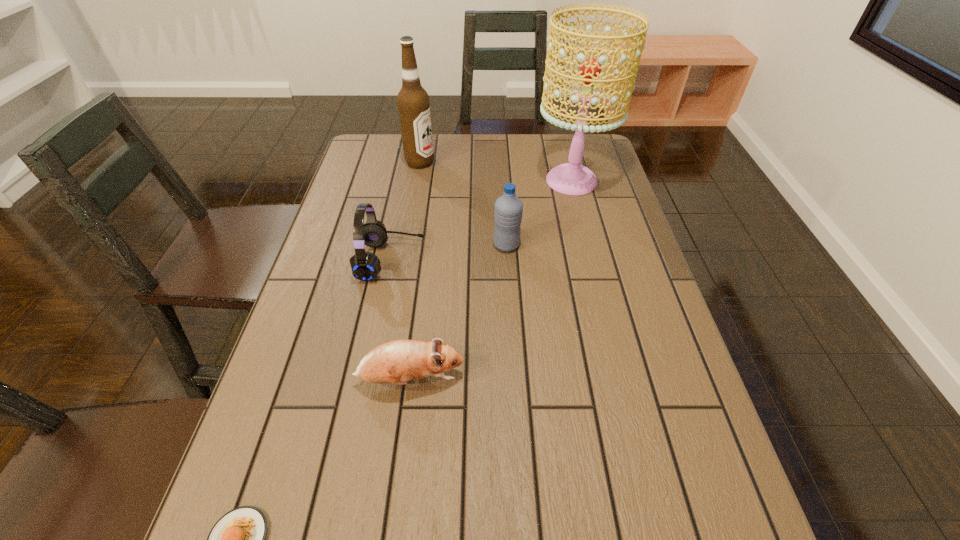
Find the location of a particular element. empty space between the water bottle and the second tallest object is located at coordinates (464, 204).

Where is `vacant area between the lampshade and the alcohol`? The width and height of the screenshot is (960, 540). vacant area between the lampshade and the alcohol is located at coordinates (495, 172).

Where is `free space between the tallest object and the fifth object from left to right`? free space between the tallest object and the fifth object from left to right is located at coordinates (540, 213).

Where is `vacant space that is in between the headset and the hamster`? vacant space that is in between the headset and the hamster is located at coordinates click(x=400, y=320).

This screenshot has width=960, height=540. In order to click on free area in between the lampshade and the fifth object from left to right in this screenshot , I will do `click(540, 213)`.

In order to click on free space between the tallest object and the hamster in this screenshot , I will do `click(492, 280)`.

At what (x,y) coordinates should I click in order to perform the action: click on vacant area between the alcohol and the lampshade. Please return your answer as a coordinate pair (x, y). Looking at the image, I should click on (495, 172).

Identify the location of object that is the second closest to the lampshade. (413, 103).

Identify the location of object that is the closest one to the tallest object. Image resolution: width=960 pixels, height=540 pixels. click(508, 210).

At what (x,y) coordinates should I click in order to perform the action: click on free spot that satisfies the following two spatial constraints: 1. on the label of the alcohol; 2. on the back side of the fifth object from left to right. Please return your answer as a coordinate pair (x, y). Looking at the image, I should click on (405, 245).